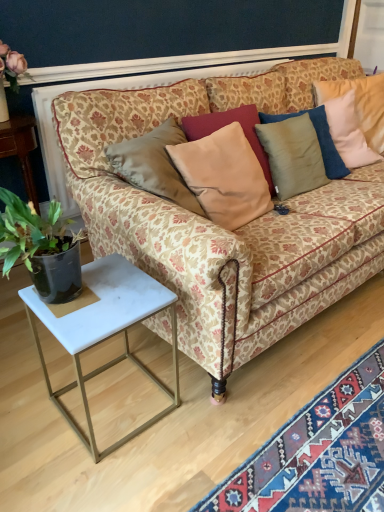
Question: Considering the relative sizes of white marble side table at lower left and satin beige pillow at center in the image provided, is white marble side table at lower left bigger than satin beige pillow at center?

Choices:
 (A) no
 (B) yes

Answer: (B)

Question: From a real-world perspective, is white marble side table at lower left physically below satin beige pillow at center?

Choices:
 (A) no
 (B) yes

Answer: (B)

Question: Is the position of white marble side table at lower left more distant than that of satin beige pillow at center?

Choices:
 (A) yes
 (B) no

Answer: (B)

Question: Is white marble side table at lower left oriented towards satin beige pillow at center?

Choices:
 (A) no
 (B) yes

Answer: (A)

Question: Considering the relative sizes of white marble side table at lower left and satin beige pillow at center in the image provided, is white marble side table at lower left thinner than satin beige pillow at center?

Choices:
 (A) yes
 (B) no

Answer: (B)

Question: Is green leafy plant at left inside the boundaries of white marble side table at lower left, or outside?

Choices:
 (A) inside
 (B) outside

Answer: (B)

Question: From a real-world perspective, is green leafy plant at left above or below white marble side table at lower left?

Choices:
 (A) above
 (B) below

Answer: (A)

Question: Considering the positions of green leafy plant at left and white marble side table at lower left in the image, is green leafy plant at left wider or thinner than white marble side table at lower left?

Choices:
 (A) thin
 (B) wide

Answer: (A)

Question: From the image's perspective, is green leafy plant at left positioned above or below white marble side table at lower left?

Choices:
 (A) above
 (B) below

Answer: (A)

Question: From the image's perspective, relative to white marble side table at lower left, is patterned fabric couch at center above or below?

Choices:
 (A) above
 (B) below

Answer: (A)

Question: Relative to white marble side table at lower left, is patterned fabric couch at center in front or behind?

Choices:
 (A) behind
 (B) front

Answer: (B)

Question: Based on their sizes in the image, would you say patterned fabric couch at center is bigger or smaller than white marble side table at lower left?

Choices:
 (A) small
 (B) big

Answer: (B)

Question: Would you say patterned fabric couch at center is inside or outside white marble side table at lower left?

Choices:
 (A) outside
 (B) inside

Answer: (A)

Question: Is white marble side table at lower left bigger or smaller than green leafy plant at left?

Choices:
 (A) small
 (B) big

Answer: (A)

Question: From a real-world perspective, is white marble side table at lower left positioned above or below green leafy plant at left?

Choices:
 (A) above
 (B) below

Answer: (B)